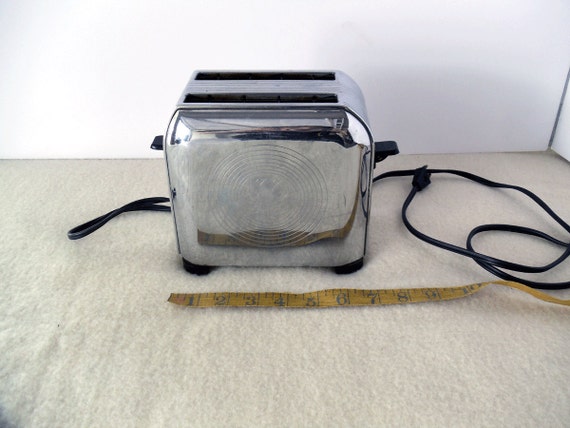
At what (x,y) coordinates should I click in order to perform the action: click on wall. Please return your answer as a coordinate pair (x, y). Image resolution: width=570 pixels, height=428 pixels. Looking at the image, I should click on (450, 74).